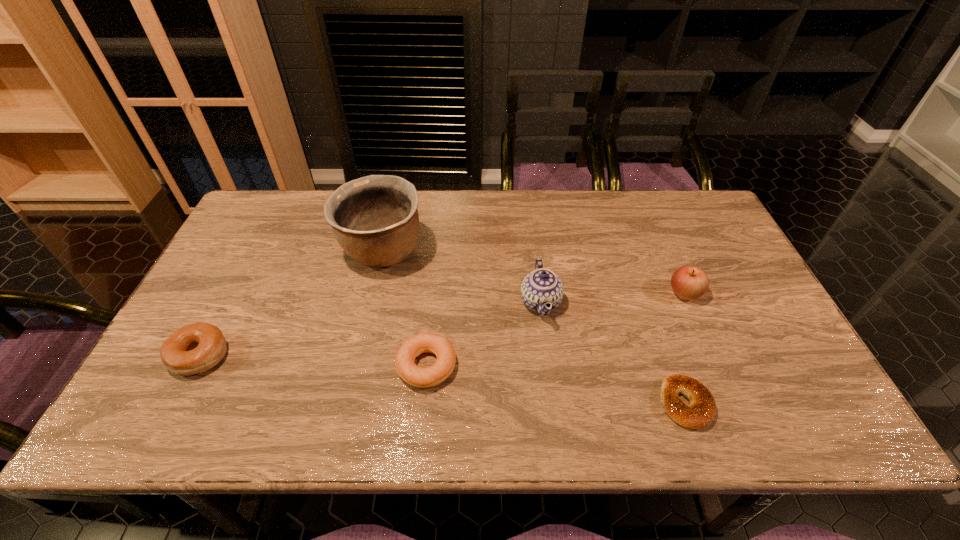
Find the location of a particular element. pottery is located at coordinates (375, 220).

In order to click on chinaware in this screenshot , I will do `click(542, 286)`.

At what (x,y) coordinates should I click in order to perform the action: click on the second tallest object. Please return your answer as a coordinate pair (x, y). The image size is (960, 540). Looking at the image, I should click on (542, 286).

You are a GUI agent. You are given a task and a screenshot of the screen. Output one action in this format:
    pyautogui.click(x=<x>, y=<y>)
    Task: Click on the fourth shortest object
    The width and height of the screenshot is (960, 540).
    Given the screenshot: What is the action you would take?
    pyautogui.click(x=688, y=282)

Identify the location of the fourth tallest object. Image resolution: width=960 pixels, height=540 pixels. (195, 348).

In order to click on the tallest bagel in this screenshot , I will do `click(195, 348)`.

Where is `the second shortest bagel`? This screenshot has width=960, height=540. the second shortest bagel is located at coordinates (412, 347).

The image size is (960, 540). Find the location of `the second bagel from left to right`. the second bagel from left to right is located at coordinates (412, 347).

Identify the location of the shortest object. (699, 413).

The image size is (960, 540). Find the location of `the shortest bagel`. the shortest bagel is located at coordinates pyautogui.click(x=699, y=413).